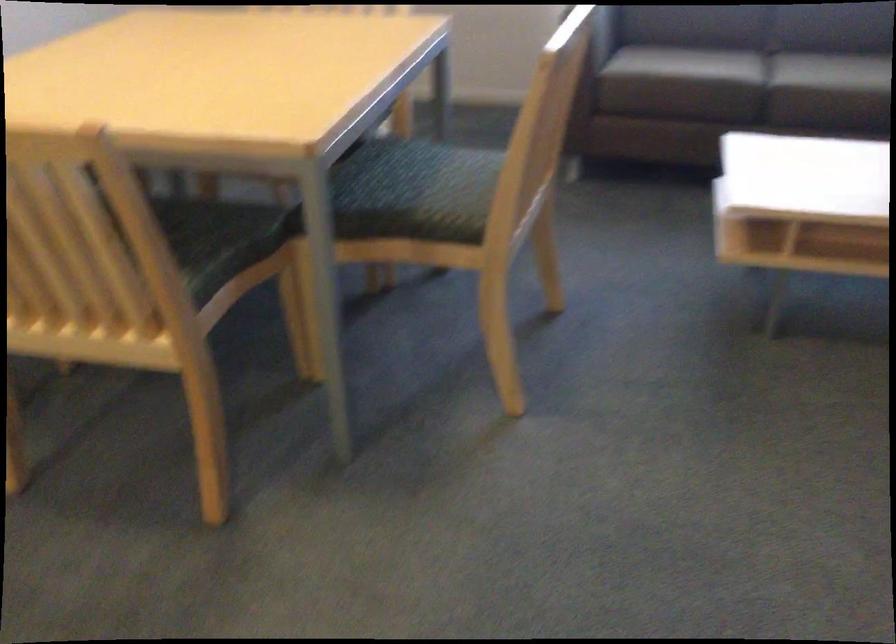
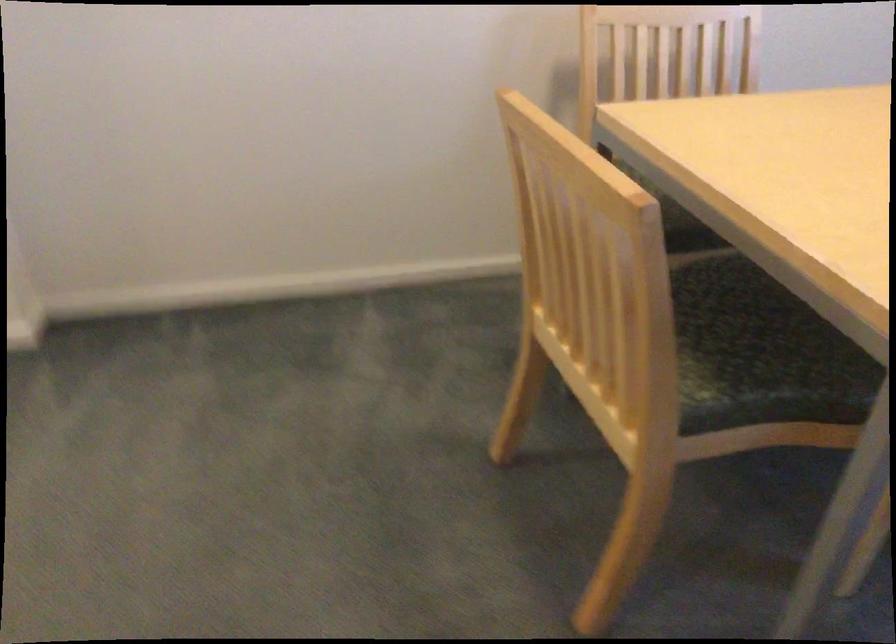
Question: The images are taken continuously from a first-person perspective. In which direction is your viewpoint rotating?

Choices:
 (A) Left
 (B) Right
 (C) Up
 (D) Down

Answer: (A)